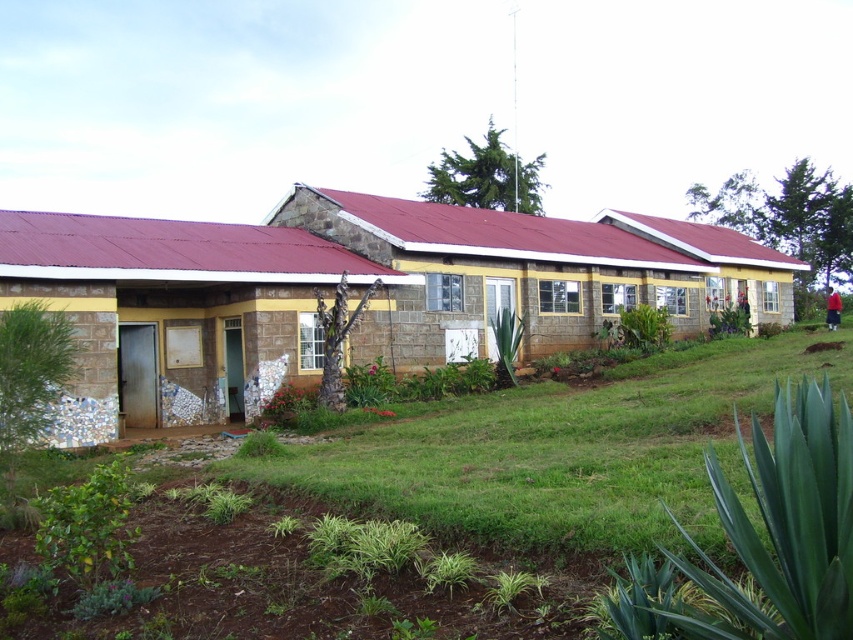
Which is above, green grass at lower center or stone textured building at center?

stone textured building at center is higher up.

Is point (618, 464) closer to viewer compared to point (612, 248)?

Yes, point (618, 464) is closer to viewer.

Where is `green grass at lower center`? green grass at lower center is located at coordinates (566, 452).

Which is below, green grass at lower center or matte stone hut at left?

green grass at lower center is below.

Can you confirm if green grass at lower center is positioned above matte stone hut at left?

No, green grass at lower center is not above matte stone hut at left.

Which is behind, point (558, 477) or point (283, 280)?

The point (283, 280) is behind.

In order to click on green grass at lower center in this screenshot , I will do `click(566, 452)`.

Does matte stone hut at left appear on the right side of stone textured building at center?

Incorrect, matte stone hut at left is not on the right side of stone textured building at center.

Does matte stone hut at left appear over stone textured building at center?

No, matte stone hut at left is not above stone textured building at center.

Who is more distant from viewer, (x=155, y=348) or (x=491, y=344)?

Positioned behind is point (x=491, y=344).

Find the location of a particular element. matte stone hut at left is located at coordinates (180, 314).